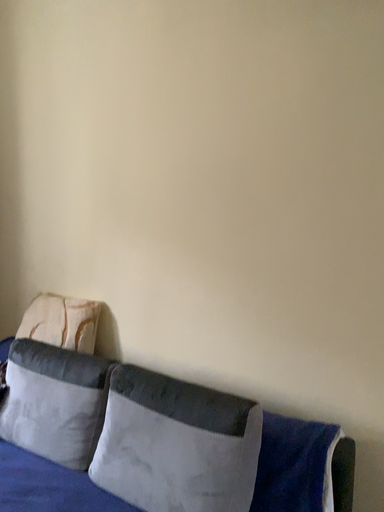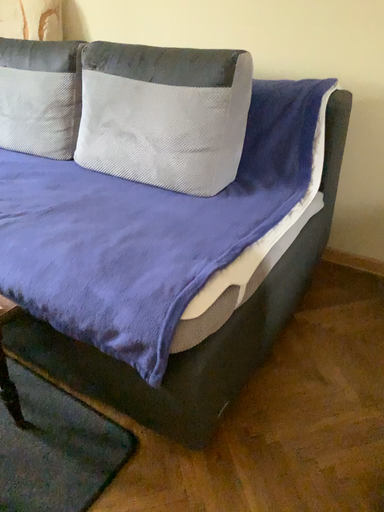
Question: Which way did the camera rotate in the video?

Choices:
 (A) rotated downward
 (B) rotated upward

Answer: (A)